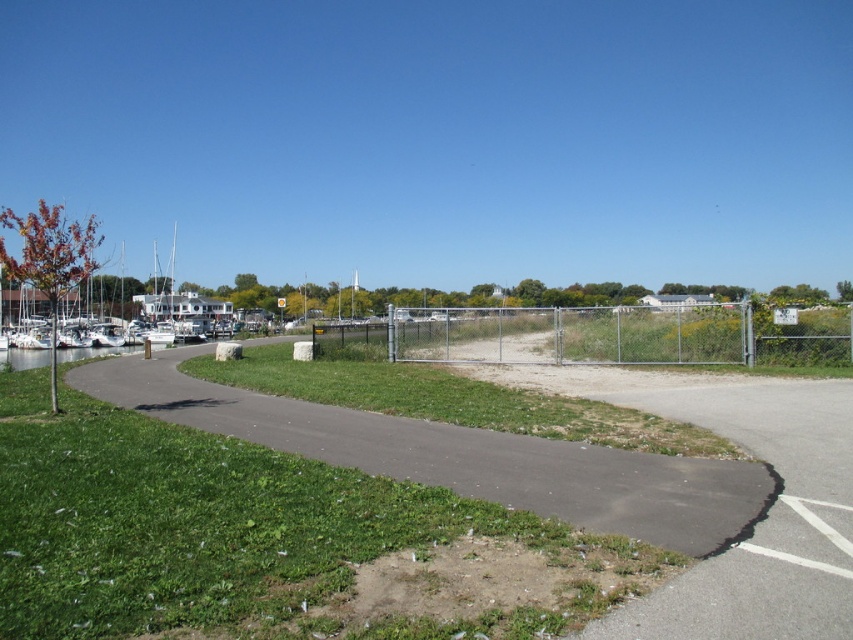
Question: Is gravel path at center to the left of metallic chain-link fence at center from the viewer's perspective?

Choices:
 (A) no
 (B) yes

Answer: (B)

Question: Which point is farther from the camera taking this photo?

Choices:
 (A) (474, 486)
 (B) (848, 356)

Answer: (B)

Question: Is gravel path at center below metallic chain-link fence at center?

Choices:
 (A) no
 (B) yes

Answer: (B)

Question: Which point is farther from the camera taking this photo?

Choices:
 (A) (778, 328)
 (B) (404, 436)

Answer: (A)

Question: Is gravel path at center to the right of metallic chain-link fence at center from the viewer's perspective?

Choices:
 (A) yes
 (B) no

Answer: (B)